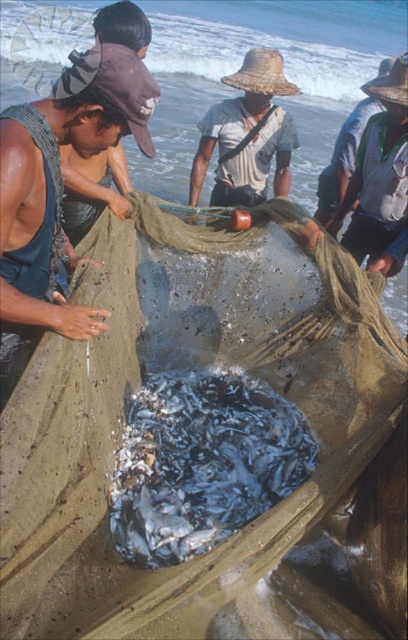
Does point (248, 412) lie behind point (383, 179)?

No, it is in front of (383, 179).

Which is above, shiny silver fish at center or natural straw hat at upper center?

natural straw hat at upper center

Locate an element on the screen. This screenshot has width=408, height=640. shiny silver fish at center is located at coordinates (201, 461).

Is point (281, 458) positioned in front of point (190, 179)?

Yes.

Who is positioned more to the left, shiny silver fish at center or natural straw hat at center?

Positioned to the left is shiny silver fish at center.

Does point (170, 392) lie in front of point (259, 170)?

Yes, point (170, 392) is closer to viewer.

Find the location of a particular element. shiny silver fish at center is located at coordinates (201, 461).

Can you confirm if shiny silver fish at center is positioned to the left of matte brown hat at left?

In fact, shiny silver fish at center is to the right of matte brown hat at left.

Where is `shiny silver fish at center`? This screenshot has height=640, width=408. shiny silver fish at center is located at coordinates (201, 461).

Locate an element on the screen. This screenshot has height=640, width=408. shiny silver fish at center is located at coordinates (201, 461).